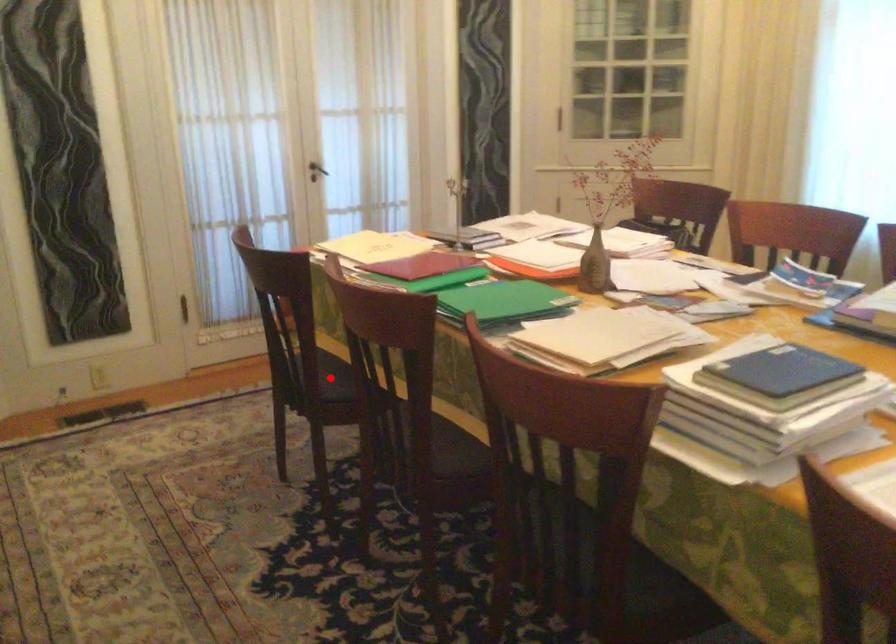
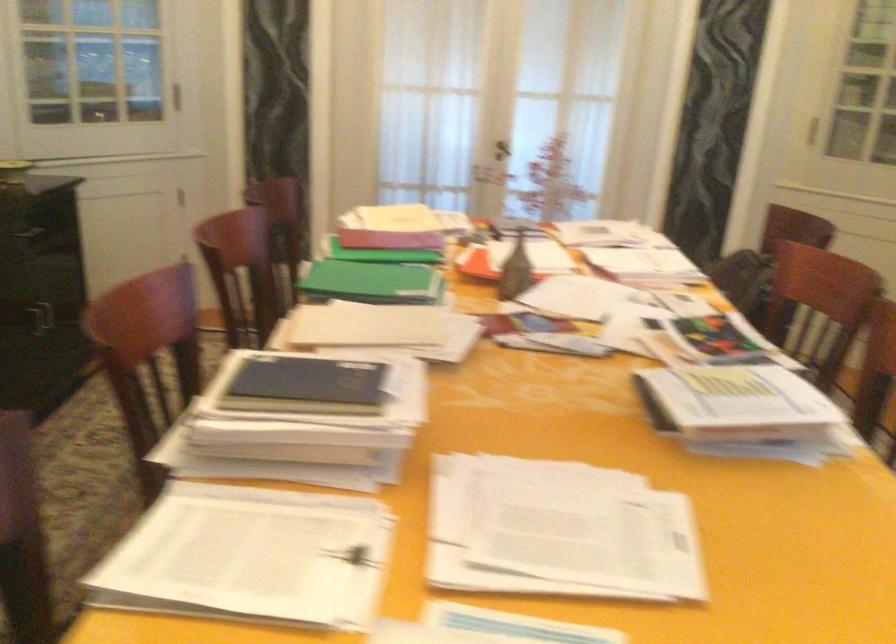
Question: I am providing you with two images of the same scene from different viewpoints. A red point is marked on the first image. At the location where the point appears in image 1, is it still visible in image 2?

Choices:
 (A) Yes
 (B) No

Answer: (B)